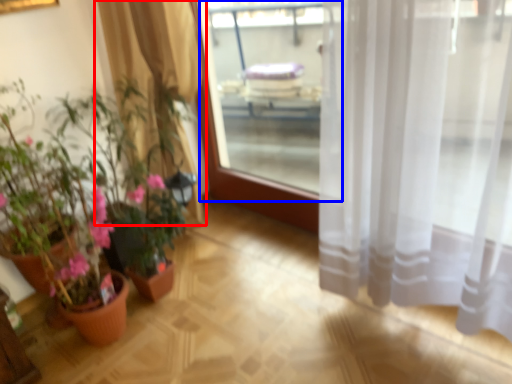
Question: Which object is further to the camera taking this photo, curtain (highlighted by a red box) or window screen (highlighted by a blue box)?

Choices:
 (A) curtain
 (B) window screen

Answer: (B)